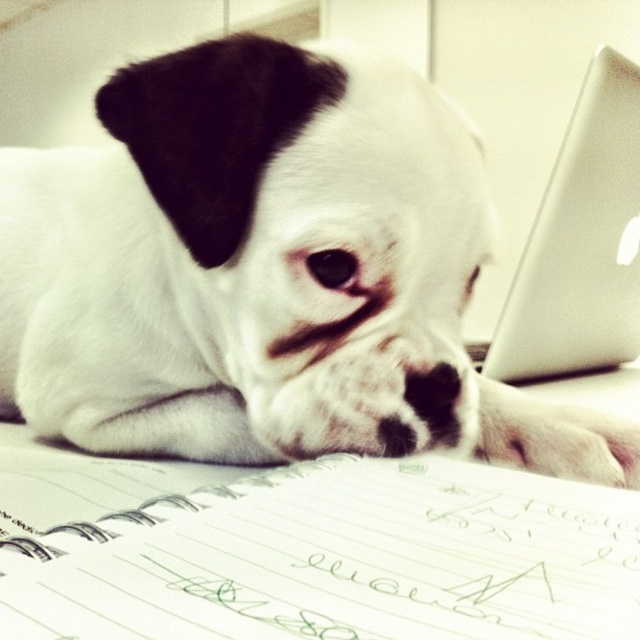
In the scene shown: You are a photographer setting up a shoot and need to position the white matte dog at center and the silver metallic laptop at upper right in such a way that the dog is visible in the frame. Based on their positions, will the dog block the view of the laptop?

The white matte dog at center is located above the silver metallic laptop at upper right, so the dog is positioned higher up and might not block the laptop entirely. However, depending on the angle and size of the dog, part of the laptop could still be visible in the lower part of the frame.

You are an animal trainer observing the scene. The white matte dog at center is positioned at coordinates 0.427, 0.416. If you need to place a treat exactly 0.1 units to the right of the dog, what are the new coordinates?

The new coordinates would be calculated by adding 0.1 to the x coordinate of the white matte dog at center. The original coordinates are (266, 273), so adding 0.1 to the x value gives 0.527. The new coordinates are therefore (266, 337).

You are trying to place a new decorative item on the desk where the white matte dog at center and silver metallic laptop at upper right are located. If you want to place the item between these two objects, where should you position it?

Since the white matte dog at center is to the left of the silver metallic laptop at upper right, you should place the decorative item between them on the desk, positioning it to the right of the white matte dog at center and to the left of the silver metallic laptop at upper right.